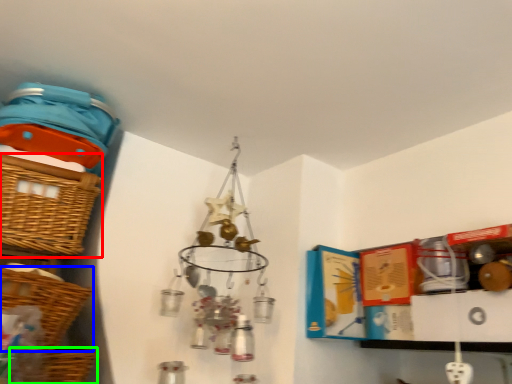
Question: Which object is the closest to the basket (highlighted by a red box)? Choose among these: basket (highlighted by a blue box) or basket (highlighted by a green box).

Choices:
 (A) basket
 (B) basket

Answer: (A)